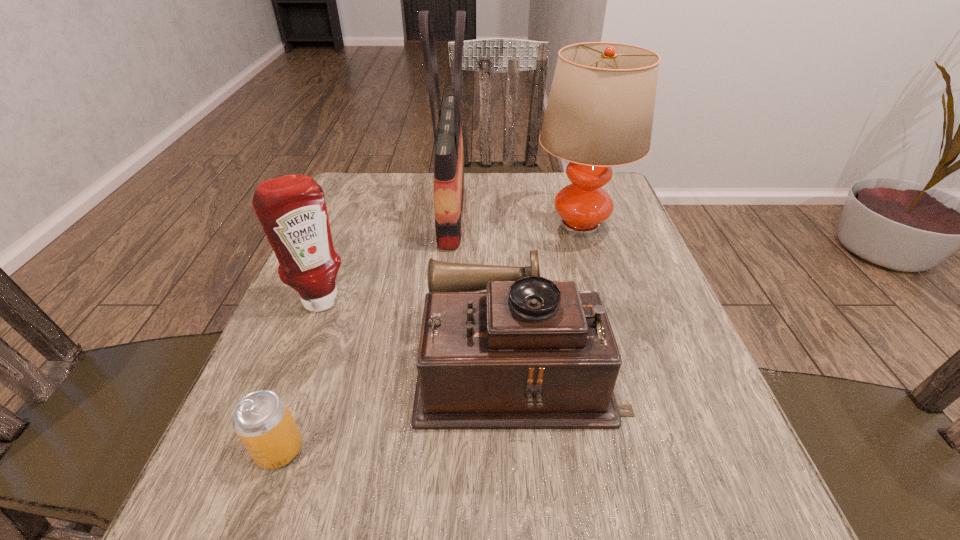
Where is `free space at the near edge of the desktop`? The height and width of the screenshot is (540, 960). free space at the near edge of the desktop is located at coordinates (339, 502).

You are a GUI agent. You are given a task and a screenshot of the screen. Output one action in this format:
    pyautogui.click(x=<x>, y=<y>)
    Task: Click on the vacant area at the left edge of the desktop
    
    Given the screenshot: What is the action you would take?
    pyautogui.click(x=382, y=247)

In the image, there is a desktop. Identify the location of vacant region at the right edge. This screenshot has height=540, width=960. coord(702,448).

In the image, there is a desktop. Where is `free space at the far left corner`? The height and width of the screenshot is (540, 960). free space at the far left corner is located at coordinates (355, 204).

Where is `vacant region at the far right corner of the desktop`? Image resolution: width=960 pixels, height=540 pixels. vacant region at the far right corner of the desktop is located at coordinates (612, 197).

At what (x,y) coordinates should I click in order to perform the action: click on vacant space at the near right corner of the desktop. Please return your answer as a coordinate pair (x, y). The height and width of the screenshot is (540, 960). Looking at the image, I should click on (682, 489).

Identify the location of free spot between the shopping bag and the shortest object. (366, 330).

The image size is (960, 540). What are the coordinates of `vacant point located between the pop (soda) and the third shortest object` in the screenshot? It's located at (300, 375).

Locate an element on the screen. The width and height of the screenshot is (960, 540). free space between the lamp and the shopping bag is located at coordinates (516, 219).

Find the location of a particular element. The image size is (960, 540). blank region between the shopping bag and the lamp is located at coordinates (516, 219).